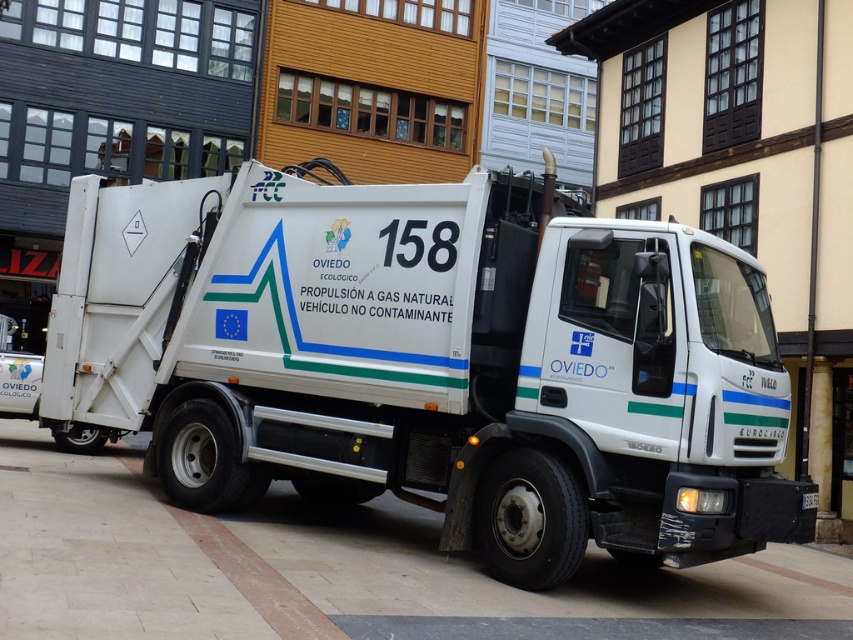
Question: Is white matte truck at center to the right of white tile pavement at center from the viewer's perspective?

Choices:
 (A) yes
 (B) no

Answer: (A)

Question: In this image, where is white matte truck at center located relative to white tile pavement at center?

Choices:
 (A) below
 (B) above

Answer: (B)

Question: Can you confirm if white matte truck at center is wider than white tile pavement at center?

Choices:
 (A) yes
 (B) no

Answer: (B)